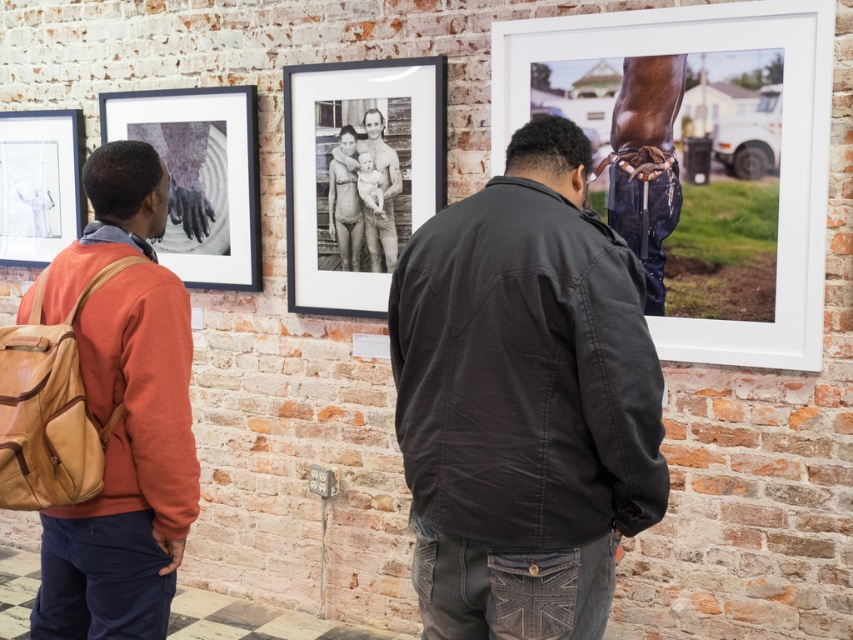
You are an art curator planning to hang a new painting that requires a frame taller than the existing ones. Looking at the matte black frame at upper left and the matte glass picture frame at upper left, which frame should you use as a reference for the minimum height requirement?

The matte black frame at upper left is much taller than the matte glass picture frame at upper left, so you should use the matte black frame at upper left as the reference for the minimum height requirement.

You are an art curator planning to hang two new frames in this exhibition. You have a black matte photo frame at center and a matte glass picture frame at upper left. Based on their current positions, which frame is positioned higher on the wall?

The matte glass picture frame at upper left is positioned higher on the wall than the black matte photo frame at center.

You are standing in front of the brick wall with the framed photographs. You want to place a new photograph of a dark gray jacket at center. According to the existing layout, where should you place it?

The dark gray jacket at center should be placed at the 2D coordinates point (523,401).